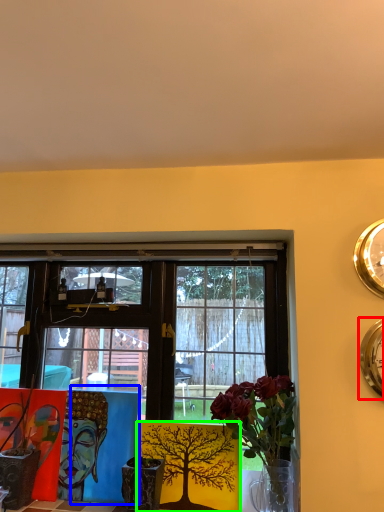
Question: Considering the real-world distances, which object is closest to clock (highlighted by a red box)? table (highlighted by a blue box) or floral arrangement (highlighted by a green box).

Choices:
 (A) table
 (B) floral arrangement

Answer: (B)